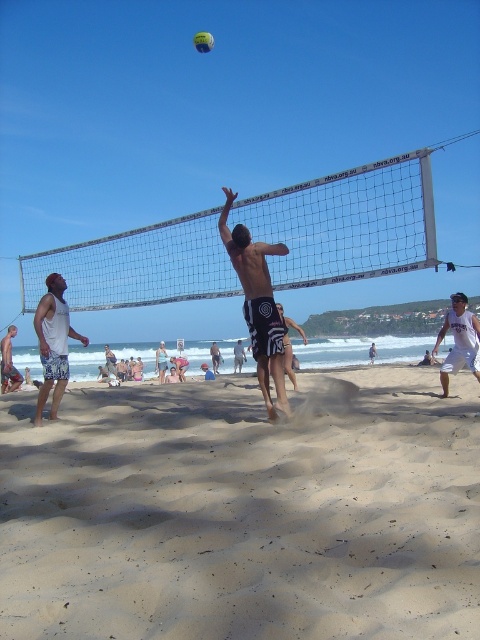
From the picture: Is black mesh shorts at center to the right of white cotton shorts at center from the viewer's perspective?

Correct, you'll find black mesh shorts at center to the right of white cotton shorts at center.

Is point (240, 284) more distant than point (236, 346)?

No, it is in front of (236, 346).

You are a GUI agent. You are given a task and a screenshot of the screen. Output one action in this format:
    pyautogui.click(x=<x>, y=<y>)
    Task: Click on the black mesh shorts at center
    
    Given the screenshot: What is the action you would take?
    pyautogui.click(x=257, y=304)

Is point (156, 364) closer to camera compared to point (204, 45)?

No, (156, 364) is further to viewer.

Find the location of a particular element. light blue denim shorts at center is located at coordinates pos(160,362).

Does point (160, 356) come in front of point (197, 42)?

No.

Where is `light blue denim shorts at center`? This screenshot has width=480, height=640. light blue denim shorts at center is located at coordinates (160, 362).

Is white mesh net at center smaller than white textured shorts at left?

No.

Between point (21, 262) and point (7, 362), which one is positioned in front?

Point (21, 262) is more forward.

Is point (71, 273) more distant than point (1, 362)?

No, it is in front of (1, 362).

Identify the location of white mesh net at center. (348, 221).